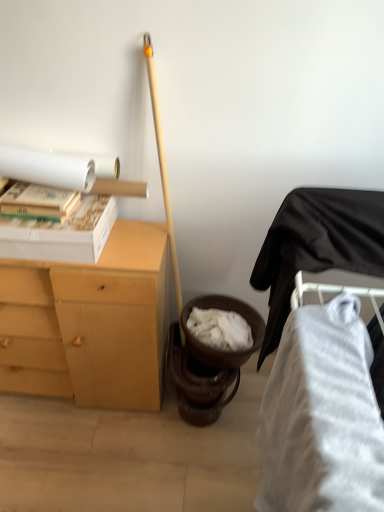
Question: Is white matte book at upper left shorter than light brown wood desk at left?

Choices:
 (A) yes
 (B) no

Answer: (A)

Question: Could you tell me if white matte book at upper left is turned towards light brown wood desk at left?

Choices:
 (A) no
 (B) yes

Answer: (A)

Question: From the image's perspective, is white matte book at upper left under light brown wood desk at left?

Choices:
 (A) yes
 (B) no

Answer: (B)

Question: Is light brown wood desk at left a part of white matte book at upper left?

Choices:
 (A) yes
 (B) no

Answer: (B)

Question: Does white matte book at upper left appear on the right side of light brown wood desk at left?

Choices:
 (A) yes
 (B) no

Answer: (A)

Question: Would you say white matte roll at upper left is inside or outside white matte book at upper left?

Choices:
 (A) outside
 (B) inside

Answer: (A)

Question: Considering their positions, is white matte roll at upper left located in front of or behind white matte book at upper left?

Choices:
 (A) front
 (B) behind

Answer: (A)

Question: From a real-world perspective, is white matte roll at upper left positioned above or below white matte book at upper left?

Choices:
 (A) above
 (B) below

Answer: (A)

Question: From the image's perspective, is white matte roll at upper left located above or below white matte book at upper left?

Choices:
 (A) above
 (B) below

Answer: (A)

Question: Would you say white matte roll at upper left is to the left or to the right of white striped fabric at lower right in the picture?

Choices:
 (A) left
 (B) right

Answer: (A)

Question: Is white matte roll at upper left taller or shorter than white striped fabric at lower right?

Choices:
 (A) short
 (B) tall

Answer: (A)

Question: In terms of size, does white matte roll at upper left appear bigger or smaller than white striped fabric at lower right?

Choices:
 (A) big
 (B) small

Answer: (B)

Question: Is white matte roll at upper left inside or outside of white striped fabric at lower right?

Choices:
 (A) outside
 (B) inside

Answer: (A)

Question: Would you say white matte roll at upper left is to the left or to the right of light brown wood desk at left in the picture?

Choices:
 (A) left
 (B) right

Answer: (B)

Question: In terms of width, does white matte roll at upper left look wider or thinner when compared to light brown wood desk at left?

Choices:
 (A) wide
 (B) thin

Answer: (B)